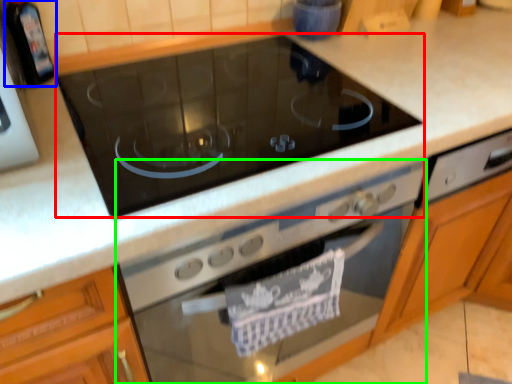
Question: Which object is the closest to the gas stove (highlighted by a red box)? Choose among these: appliance (highlighted by a blue box) or home appliance (highlighted by a green box).

Choices:
 (A) appliance
 (B) home appliance

Answer: (B)